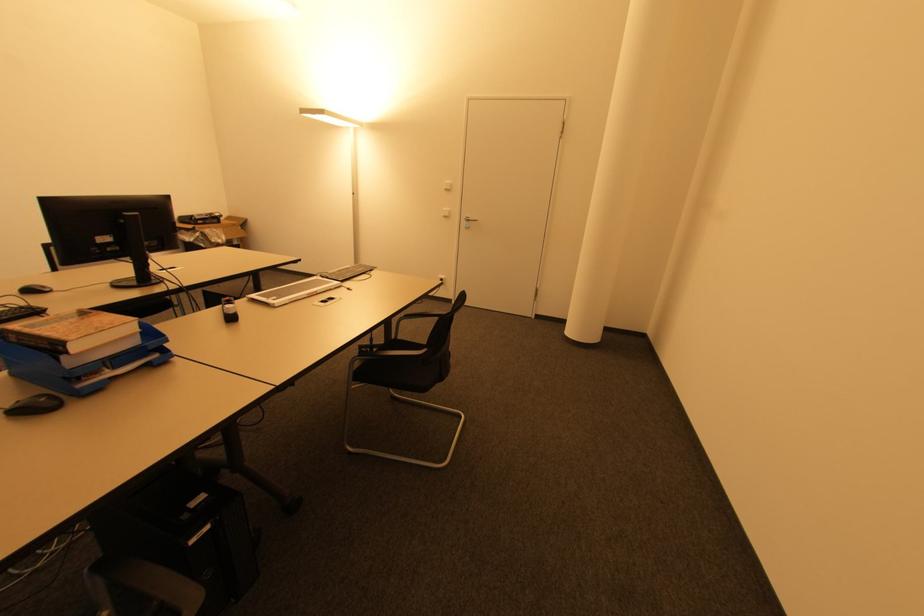
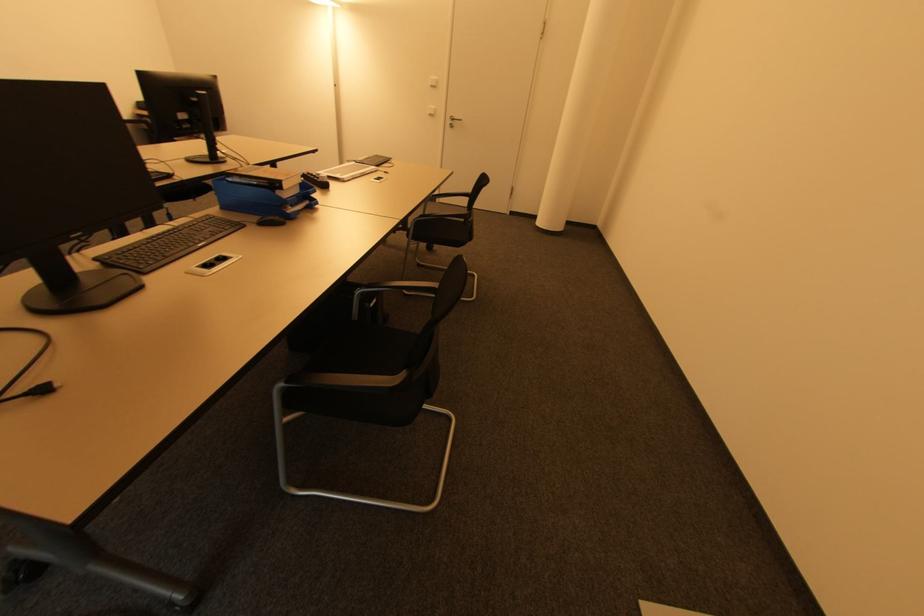
Question: Based on the continuous images, in which direction is the camera rotating? Reply with the corresponding letter.

Choices:
 (A) Left
 (B) Right
 (C) Up
 (D) Down

Answer: (D)